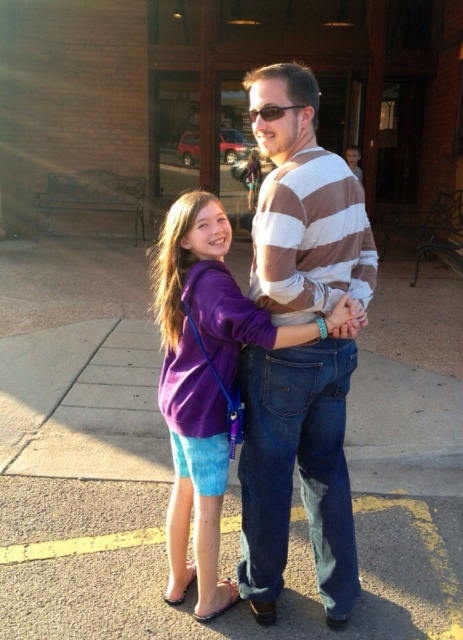
Who is higher up, smooth concrete pavement at center or purple cotton hoodie at center?

Positioned higher is purple cotton hoodie at center.

Measure the distance between point (430, 284) and camera.

A: Point (430, 284) is 7.91 meters away from camera.

Between point (94, 538) and point (174, 433), which one is positioned behind?

The point (94, 538) is behind.

Locate an element on the screen. smooth concrete pavement at center is located at coordinates (171, 472).

Between smooth concrete pavement at center and striped cotton shirt at center, which one is positioned higher?

striped cotton shirt at center is higher up.

Between smooth concrete pavement at center and striped cotton shirt at center, which one has more height?

striped cotton shirt at center

Is point (163, 444) positioned before point (256, 472)?

That is False.

The width and height of the screenshot is (463, 640). Find the location of `smooth concrete pavement at center`. smooth concrete pavement at center is located at coordinates (171, 472).

Does smooth concrete pavement at center have a larger size compared to matte purple shirt at center?

Yes, smooth concrete pavement at center is bigger than matte purple shirt at center.

Does smooth concrete pavement at center have a greater height compared to matte purple shirt at center?

No.

I want to click on smooth concrete pavement at center, so click(171, 472).

Find the location of a particular element. Image resolution: width=463 pixels, height=640 pixels. smooth concrete pavement at center is located at coordinates (171, 472).